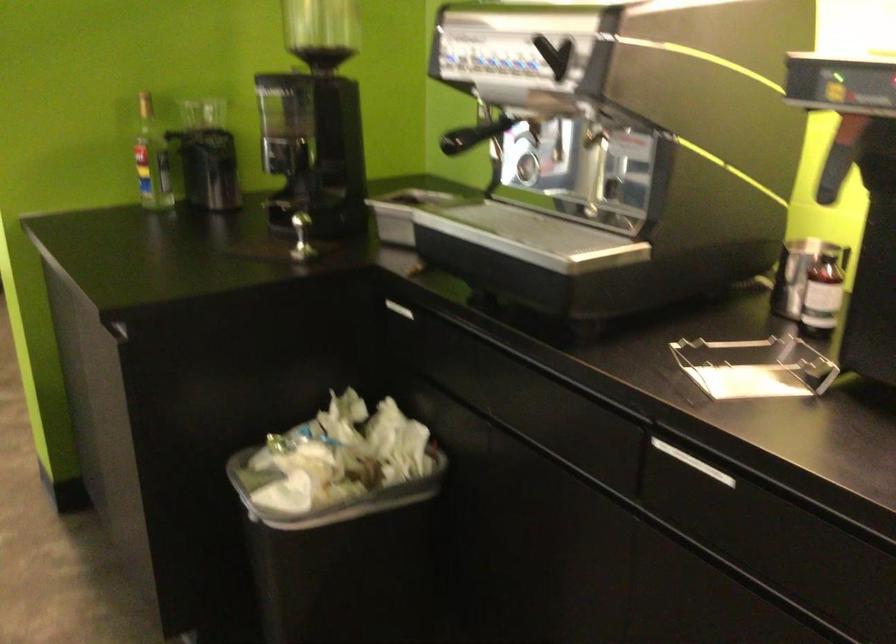
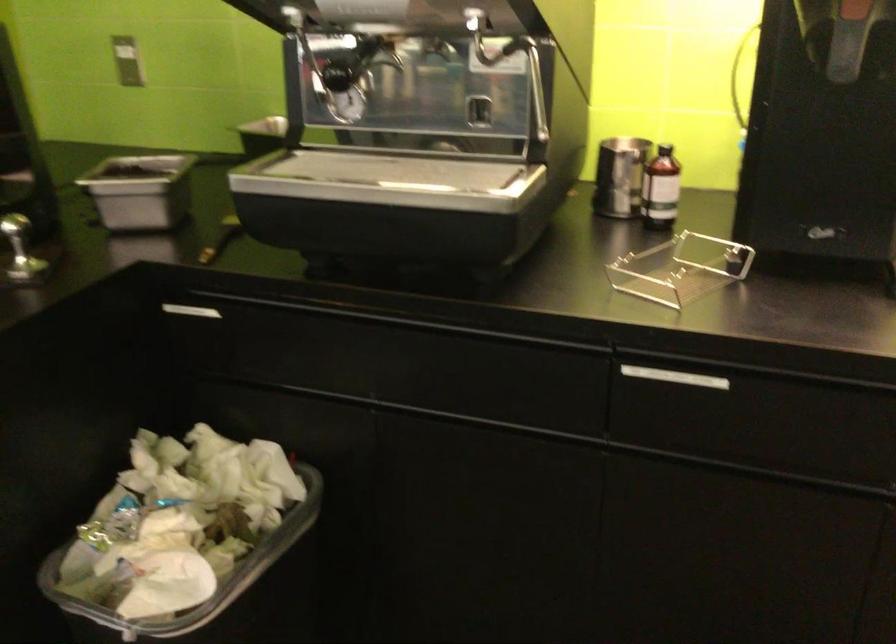
Where in the second image is the point corresponding to the point at 397,308 from the first image?

(192, 310)